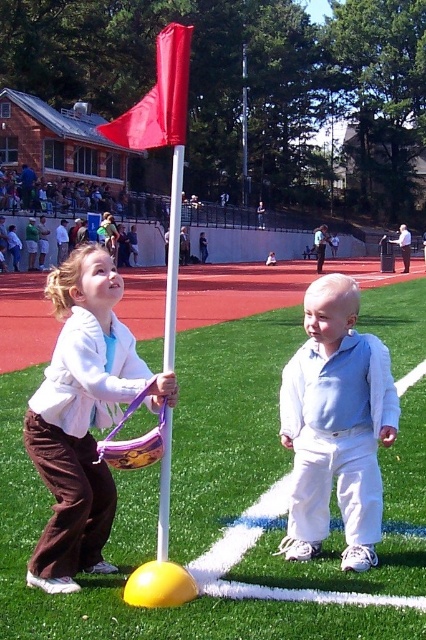
Can you confirm if matte yellow base at center is thinner than matte brown pants at lower left?

In fact, matte yellow base at center might be wider than matte brown pants at lower left.

Which is below, matte yellow base at center or matte brown pants at lower left?

matte brown pants at lower left

Between point (376, 314) and point (80, 346), which one is positioned in front?

Positioned in front is point (80, 346).

At what (x,y) coordinates should I click in order to perform the action: click on matte yellow base at center. Please return your answer as a coordinate pair (x, y). The image size is (426, 640). Looking at the image, I should click on (227, 570).

Is matte brown pants at lower left below red fabric flagpole at center?

Yes.

Is point (80, 321) closer to viewer compared to point (166, 461)?

No, it is behind (166, 461).

Find the location of a particular element. matte brown pants at lower left is located at coordinates (80, 417).

Is matte brown pants at lower left smaller than light blue cotton shirt at center?

Correct, matte brown pants at lower left occupies less space than light blue cotton shirt at center.

Who is more forward, (72, 531) or (285, 426)?

Point (72, 531) is more forward.

Which is in front, point (97, 380) or point (331, 291)?

Point (97, 380) is in front.

You are a GUI agent. You are given a task and a screenshot of the screen. Output one action in this format:
    pyautogui.click(x=<x>, y=<y>)
    Task: Click on the matte brown pants at lower left
    The height and width of the screenshot is (640, 426).
    Given the screenshot: What is the action you would take?
    pyautogui.click(x=80, y=417)